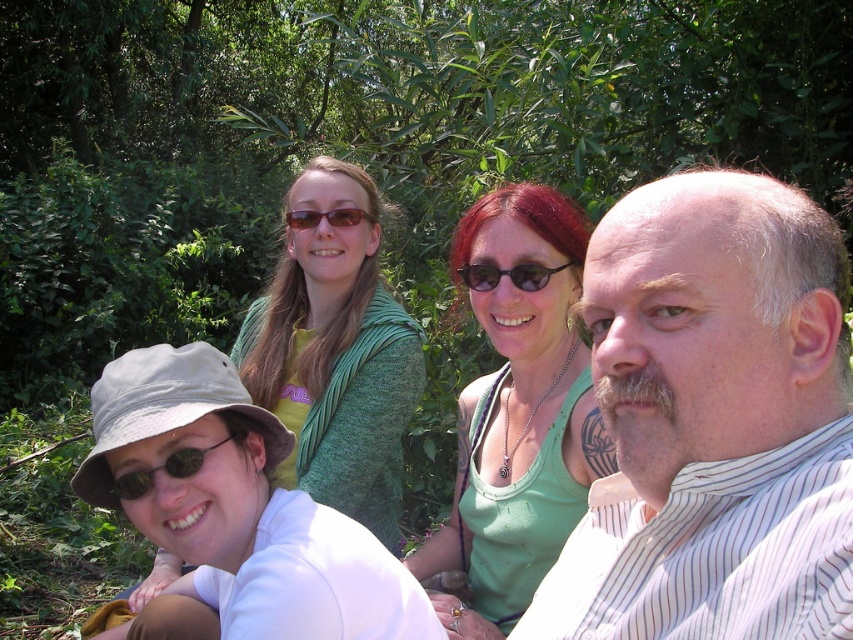
In the scene shown: You are a photographer trying to capture a closeup shot of the black plastic sunglasses at center and the brown matte sunglasses at upper center. Which pair of sunglasses is shorter in height?

The black plastic sunglasses at center has a lesser height compared to the brown matte sunglasses at upper center, so the black plastic sunglasses at center is shorter in height.

You are a photographer trying to capture a group photo of the white striped shirt at center and the green fabric tank top at center. If your camera has a maximum focus range of 30 inches, will both subjects be in focus?

The white striped shirt at center and green fabric tank top at center are 32.33 inches apart from each other. Since the distance between them exceeds the camera focus range of 30 inches, both subjects may not be in focus simultaneously.

You are a photographer trying to capture a closeup of the black plastic sunglasses at center and the brown matte sunglasses at upper center. Considering their sizes, which one would require you to move closer to get a clear shot?

The black plastic sunglasses at center occupies less space than the brown matte sunglasses at upper center, so you would need to move closer to the black plastic sunglasses at center to capture a clear closeup.